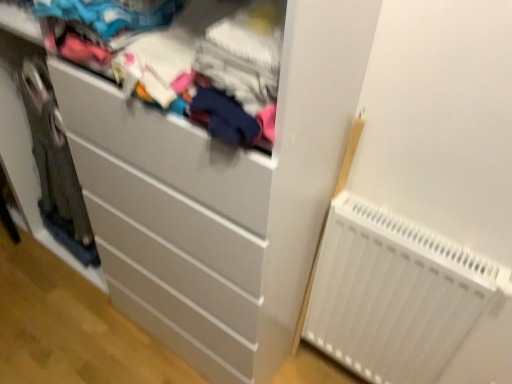
Question: Considering the relative positions of white matte chest of drawers at center and white plastic radiator at lower right in the image provided, is white matte chest of drawers at center behind white plastic radiator at lower right?

Choices:
 (A) no
 (B) yes

Answer: (A)

Question: Is white matte chest of drawers at center taller than white plastic radiator at lower right?

Choices:
 (A) yes
 (B) no

Answer: (A)

Question: Are white matte chest of drawers at center and white plastic radiator at lower right located far from each other?

Choices:
 (A) no
 (B) yes

Answer: (A)

Question: From the image's perspective, is white matte chest of drawers at center on white plastic radiator at lower right?

Choices:
 (A) yes
 (B) no

Answer: (A)

Question: Is white matte chest of drawers at center beside white plastic radiator at lower right?

Choices:
 (A) no
 (B) yes

Answer: (A)

Question: Is white matte chest of drawers at center wider than white plastic radiator at lower right?

Choices:
 (A) yes
 (B) no

Answer: (A)

Question: Is white plastic radiator at lower right next to white matte chest of drawers at center and touching it?

Choices:
 (A) no
 (B) yes

Answer: (A)

Question: From the image's perspective, does white plastic radiator at lower right appear lower than white matte chest of drawers at center?

Choices:
 (A) no
 (B) yes

Answer: (B)

Question: From a real-world perspective, is white plastic radiator at lower right physically below white matte chest of drawers at center?

Choices:
 (A) yes
 (B) no

Answer: (A)

Question: Is white plastic radiator at lower right wider than white matte chest of drawers at center?

Choices:
 (A) no
 (B) yes

Answer: (A)

Question: Can you confirm if white plastic radiator at lower right is thinner than white matte chest of drawers at center?

Choices:
 (A) yes
 (B) no

Answer: (A)

Question: Is white plastic radiator at lower right smaller than white matte chest of drawers at center?

Choices:
 (A) yes
 (B) no

Answer: (A)

Question: Is matte fabric clothes at upper center closer to camera compared to white plastic radiator at lower right?

Choices:
 (A) yes
 (B) no

Answer: (A)